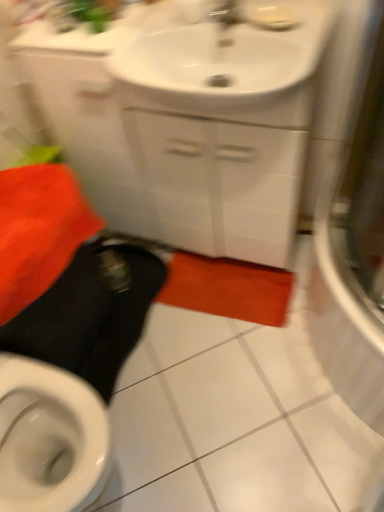
Question: Is white glossy cabinet at upper center outside black rubber squat at lower left?

Choices:
 (A) yes
 (B) no

Answer: (A)

Question: Is white glossy cabinet at upper center aimed at black rubber squat at lower left?

Choices:
 (A) no
 (B) yes

Answer: (B)

Question: From a real-world perspective, is white glossy cabinet at upper center located beneath black rubber squat at lower left?

Choices:
 (A) no
 (B) yes

Answer: (A)

Question: Does white glossy cabinet at upper center have a greater width compared to black rubber squat at lower left?

Choices:
 (A) yes
 (B) no

Answer: (B)

Question: Is black rubber squat at lower left completely or partially inside white glossy cabinet at upper center?

Choices:
 (A) no
 (B) yes

Answer: (A)

Question: Which is correct: white glossy sink at upper center is inside black rubber squat at lower left, or outside of it?

Choices:
 (A) outside
 (B) inside

Answer: (A)

Question: Based on their sizes in the image, would you say white glossy sink at upper center is bigger or smaller than black rubber squat at lower left?

Choices:
 (A) small
 (B) big

Answer: (A)

Question: From the image's perspective, is white glossy sink at upper center located above or below black rubber squat at lower left?

Choices:
 (A) above
 (B) below

Answer: (A)

Question: Considering the positions of white glossy sink at upper center and black rubber squat at lower left in the image, is white glossy sink at upper center taller or shorter than black rubber squat at lower left?

Choices:
 (A) short
 (B) tall

Answer: (A)

Question: From their relative heights in the image, would you say white glossy sink at upper center is taller or shorter than transparent glass shower door at right?

Choices:
 (A) short
 (B) tall

Answer: (A)

Question: Looking at the image, does white glossy sink at upper center seem bigger or smaller compared to transparent glass shower door at right?

Choices:
 (A) small
 (B) big

Answer: (A)

Question: From a real-world perspective, is white glossy sink at upper center positioned above or below transparent glass shower door at right?

Choices:
 (A) below
 (B) above

Answer: (B)

Question: Considering their positions, is white glossy sink at upper center located in front of or behind transparent glass shower door at right?

Choices:
 (A) behind
 (B) front

Answer: (B)

Question: Which is correct: white glossy cabinet at upper center is inside white glossy sink at upper center, or outside of it?

Choices:
 (A) outside
 (B) inside

Answer: (A)

Question: From the image's perspective, is white glossy cabinet at upper center positioned above or below white glossy sink at upper center?

Choices:
 (A) below
 (B) above

Answer: (A)